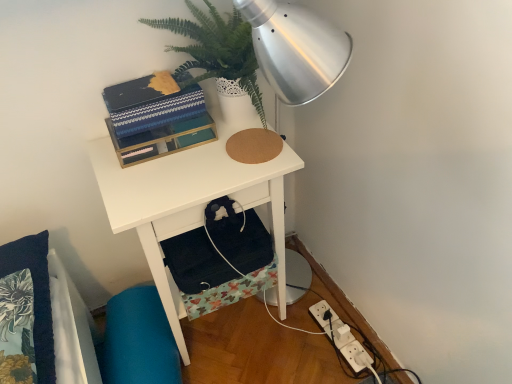
Question: Considering the relative sizes of white matte desk at center and white plastic power outlet at lower right in the image provided, is white matte desk at center thinner than white plastic power outlet at lower right?

Choices:
 (A) yes
 (B) no

Answer: (B)

Question: Is white matte desk at center smaller than white plastic power outlet at lower right?

Choices:
 (A) no
 (B) yes

Answer: (A)

Question: Does white matte desk at center have a lesser height compared to white plastic power outlet at lower right?

Choices:
 (A) yes
 (B) no

Answer: (B)

Question: Can we say white matte desk at center lies outside white plastic power outlet at lower right?

Choices:
 (A) no
 (B) yes

Answer: (B)

Question: From a real-world perspective, is white matte desk at center located beneath white plastic power outlet at lower right?

Choices:
 (A) yes
 (B) no

Answer: (B)

Question: From the image's perspective, is green leafy plant at upper center located above or below white plastic power outlet at lower right?

Choices:
 (A) above
 (B) below

Answer: (A)

Question: Is point (256, 107) closer or farther from the camera than point (317, 321)?

Choices:
 (A) farther
 (B) closer

Answer: (B)

Question: In terms of width, does green leafy plant at upper center look wider or thinner when compared to white plastic power outlet at lower right?

Choices:
 (A) thin
 (B) wide

Answer: (A)

Question: In the image, is green leafy plant at upper center on the left side or the right side of white plastic power outlet at lower right?

Choices:
 (A) left
 (B) right

Answer: (A)

Question: Based on their sizes in the image, would you say teal fabric swivel chair at lower left is bigger or smaller than white plastic power outlet at lower right?

Choices:
 (A) big
 (B) small

Answer: (A)

Question: From their relative heights in the image, would you say teal fabric swivel chair at lower left is taller or shorter than white plastic power outlet at lower right?

Choices:
 (A) tall
 (B) short

Answer: (A)

Question: Is point (139, 354) closer or farther from the camera than point (354, 339)?

Choices:
 (A) closer
 (B) farther

Answer: (A)

Question: From a real-world perspective, is teal fabric swivel chair at lower left above or below white plastic power outlet at lower right?

Choices:
 (A) below
 (B) above

Answer: (B)

Question: In the image, is matte black book at upper center positioned in front of or behind white plastic power outlet at lower right?

Choices:
 (A) behind
 (B) front

Answer: (B)

Question: Do you think matte black book at upper center is within white plastic power outlet at lower right, or outside of it?

Choices:
 (A) inside
 (B) outside

Answer: (B)